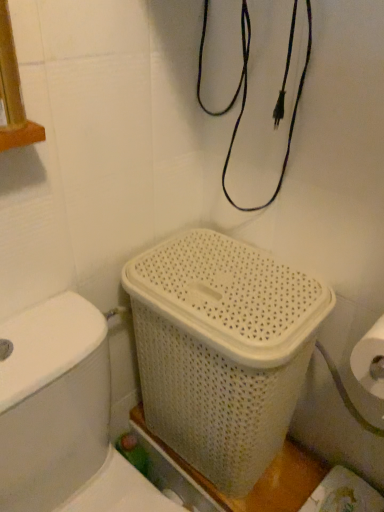
Question: Is white plastic toilet at lower left in contact with white woven basket at center?

Choices:
 (A) yes
 (B) no

Answer: (B)

Question: Considering the relative positions of white plastic toilet at lower left and white woven basket at center in the image provided, is white plastic toilet at lower left to the right of white woven basket at center from the viewer's perspective?

Choices:
 (A) no
 (B) yes

Answer: (A)

Question: From a real-world perspective, is white plastic toilet at lower left under white woven basket at center?

Choices:
 (A) yes
 (B) no

Answer: (A)

Question: Is white plastic toilet at lower left not near white woven basket at center?

Choices:
 (A) yes
 (B) no

Answer: (B)

Question: From the image's perspective, is white plastic toilet at lower left below white woven basket at center?

Choices:
 (A) yes
 (B) no

Answer: (A)

Question: Does white plastic toilet at lower left have a larger size compared to white woven basket at center?

Choices:
 (A) no
 (B) yes

Answer: (B)

Question: Is white woven basket at center looking in the opposite direction of white plastic toilet at lower left?

Choices:
 (A) yes
 (B) no

Answer: (B)

Question: Can you confirm if white woven basket at center is shorter than white plastic toilet at lower left?

Choices:
 (A) yes
 (B) no

Answer: (A)

Question: Is there a large distance between white woven basket at center and white plastic toilet at lower left?

Choices:
 (A) yes
 (B) no

Answer: (B)

Question: Is white woven basket at center not inside white plastic toilet at lower left?

Choices:
 (A) no
 (B) yes

Answer: (B)

Question: Does white woven basket at center have a lesser width compared to white plastic toilet at lower left?

Choices:
 (A) yes
 (B) no

Answer: (A)

Question: Is white woven basket at center to the right of white plastic toilet at lower left from the viewer's perspective?

Choices:
 (A) yes
 (B) no

Answer: (A)

Question: Considering the positions of white woven basket at center and white plastic toilet at lower left in the image, is white woven basket at center taller or shorter than white plastic toilet at lower left?

Choices:
 (A) tall
 (B) short

Answer: (B)